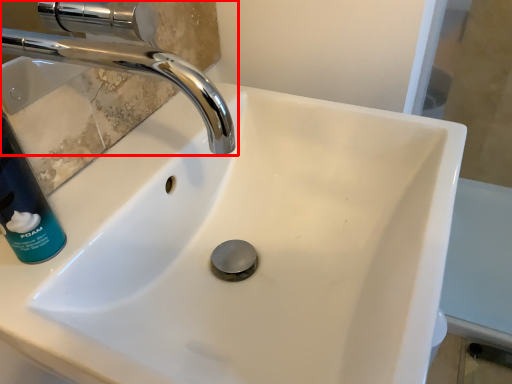
Question: Considering the relative positions of tap (annotated by the red box) and cleaning product in the image provided, where is tap (annotated by the red box) located with respect to the staircase?

Choices:
 (A) right
 (B) left

Answer: (A)